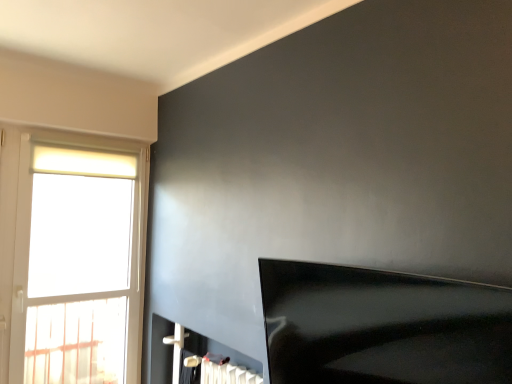
What is the approximate height of white glass window at left?

white glass window at left is 1.63 meters in height.

The image size is (512, 384). Describe the element at coordinates (382, 327) in the screenshot. I see `black glossy tv at lower right` at that location.

You are a GUI agent. You are given a task and a screenshot of the screen. Output one action in this format:
    pyautogui.click(x=<x>, y=<y>)
    Task: Click on the white glossy fireplace at lower center
    The height and width of the screenshot is (384, 512).
    Given the screenshot: What is the action you would take?
    pyautogui.click(x=197, y=359)

The height and width of the screenshot is (384, 512). Find the location of `white glass window at left`. white glass window at left is located at coordinates (73, 256).

Considering the positions of point (118, 355) and point (327, 322), is point (118, 355) closer or farther from the camera than point (327, 322)?

Point (118, 355).

Considering the sizes of objects white glass window at left and black glossy tv at lower right in the image provided, who is wider, white glass window at left or black glossy tv at lower right?

Wider between the two is black glossy tv at lower right.

Which of these two, white glass window at left or black glossy tv at lower right, stands taller?

Standing taller between the two is white glass window at left.

Locate an element on the screen. furniture in front of the white glass window at left is located at coordinates (382, 327).

Is black glossy tv at lower right at the back of white glossy fireplace at lower center?

That's not correct — white glossy fireplace at lower center is not looking away from black glossy tv at lower right.

From the image's perspective, between white glossy fireplace at lower center and black glossy tv at lower right, which one is located above?

black glossy tv at lower right, from the image's perspective.

How distant is white glossy fireplace at lower center from black glossy tv at lower right?

white glossy fireplace at lower center is 1.06 meters from black glossy tv at lower right.

In order to click on furniture that is in front of the white glossy fireplace at lower center in this screenshot , I will do `click(382, 327)`.

Which is correct: black glossy tv at lower right is inside white glossy fireplace at lower center, or outside of it?

black glossy tv at lower right is located beyond the bounds of white glossy fireplace at lower center.

Is black glossy tv at lower right placed right next to white glossy fireplace at lower center?

black glossy tv at lower right and white glossy fireplace at lower center are not in contact.

Considering the positions of objects black glossy tv at lower right and white glossy fireplace at lower center in the image provided, who is more to the right, black glossy tv at lower right or white glossy fireplace at lower center?

black glossy tv at lower right.

Consider the image. Which object is positioned more to the left, white glass window at left or white glossy fireplace at lower center?

From the viewer's perspective, white glass window at left appears more on the left side.

Can you confirm if white glass window at left is wider than white glossy fireplace at lower center?

In fact, white glass window at left might be narrower than white glossy fireplace at lower center.

From the image's perspective, which one is positioned higher, white glass window at left or white glossy fireplace at lower center?

From the image's view, white glass window at left is above.

Is the depth of white glossy fireplace at lower center less than that of white glass window at left?

Yes, white glossy fireplace at lower center is closer to the camera.

From the image's perspective, is white glossy fireplace at lower center above or below white glass window at left?

Clearly, from the image's perspective, white glossy fireplace at lower center is below white glass window at left.

You are a GUI agent. You are given a task and a screenshot of the screen. Output one action in this format:
    pyautogui.click(x=<x>, y=<y>)
    Task: Click on the fireplace in front of the white glass window at left
    Image resolution: width=512 pixels, height=384 pixels.
    Given the screenshot: What is the action you would take?
    pyautogui.click(x=197, y=359)

Who is smaller, white glossy fireplace at lower center or white glass window at left?

white glossy fireplace at lower center is smaller.

From the image's perspective, which is above, black glossy tv at lower right or white glass window at left?

From the image's view, white glass window at left is above.

Would you say black glossy tv at lower right is inside or outside white glass window at left?

The correct answer is: outside.

Is black glossy tv at lower right looking in the opposite direction of white glass window at left?

No, white glass window at left is not at the back of black glossy tv at lower right.

Considering the relative sizes of black glossy tv at lower right and white glass window at left in the image provided, is black glossy tv at lower right shorter than white glass window at left?

Indeed, black glossy tv at lower right has a lesser height compared to white glass window at left.

Find the location of a particular element. Image resolution: width=512 pixels, height=384 pixels. window behind the black glossy tv at lower right is located at coordinates (73, 256).

Identify the location of fireplace to the left of black glossy tv at lower right. This screenshot has width=512, height=384. (197, 359).

Considering their positions, is white glass window at left positioned closer to black glossy tv at lower right than white glossy fireplace at lower center?

The object closer to black glossy tv at lower right is white glossy fireplace at lower center.

From the image, which object appears to be farther from white glossy fireplace at lower center, black glossy tv at lower right or white glass window at left?

The object further to white glossy fireplace at lower center is black glossy tv at lower right.

From the picture: Which object lies nearer to the anchor point white glossy fireplace at lower center, white glass window at left or black glossy tv at lower right?

white glass window at left.

Estimate the real-world distances between objects in this image. Which object is further from black glossy tv at lower right, white glossy fireplace at lower center or white glass window at left?

white glass window at left lies further to black glossy tv at lower right than the other object.

Estimate the real-world distances between objects in this image. Which object is further from white glass window at left, white glossy fireplace at lower center or black glossy tv at lower right?

black glossy tv at lower right.

Based on their spatial positions, is black glossy tv at lower right or white glossy fireplace at lower center closer to white glass window at left?

Among the two, white glossy fireplace at lower center is located nearer to white glass window at left.

Identify the location of fireplace located between black glossy tv at lower right and white glass window at left in the depth direction. Image resolution: width=512 pixels, height=384 pixels. (197, 359).